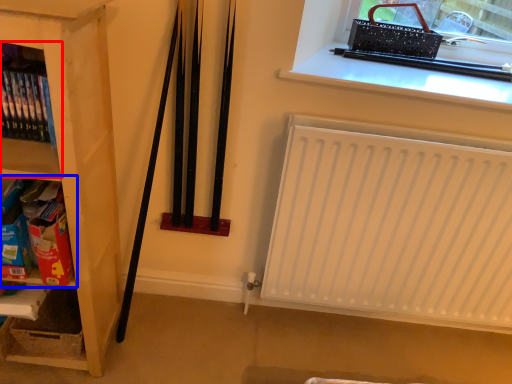
Question: Which point is further to the camera, shelf (highlighted by a red box) or shelf (highlighted by a blue box)?

Choices:
 (A) shelf
 (B) shelf

Answer: (B)